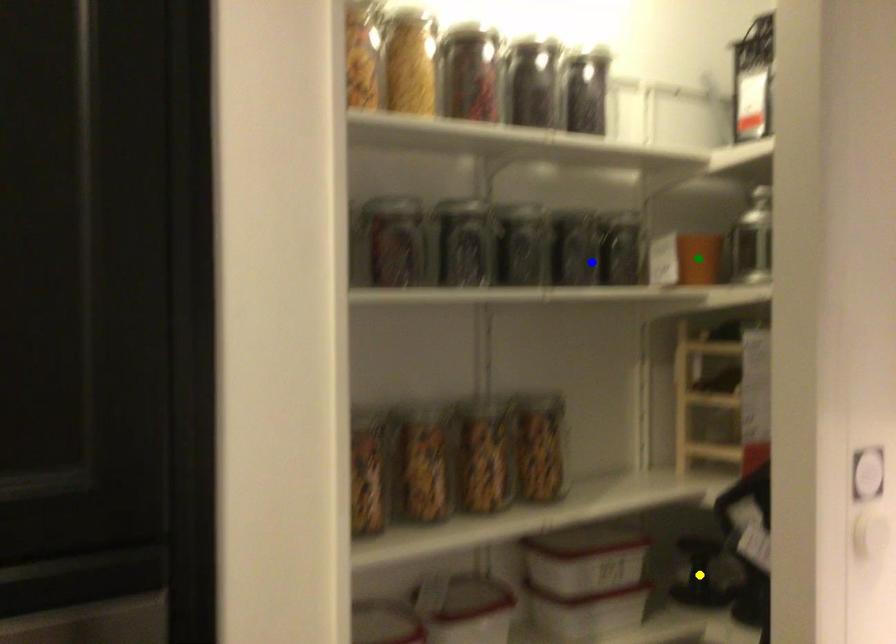
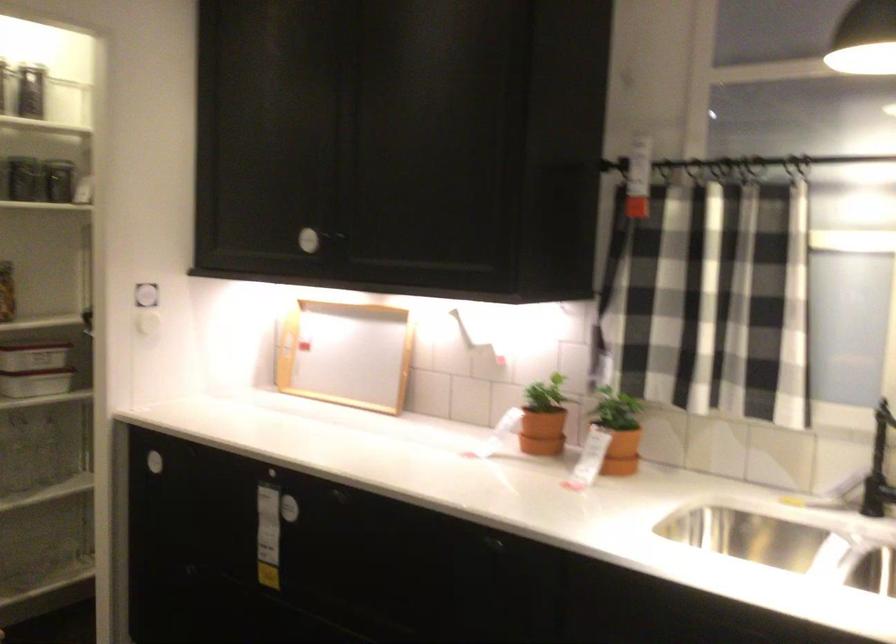
I am providing you with two images of the same scene from different viewpoints. Three points are marked in image1. Which point corresponds to a part or object that is occluded in image2?In image1, three points are marked. Which of them correspond to a part or object that is occluded in image2?Among the three points shown in image1, which one corresponds to a part or object that is no longer visible due to occlusion in image2?

yellow point, green point cannot be seen in image2.